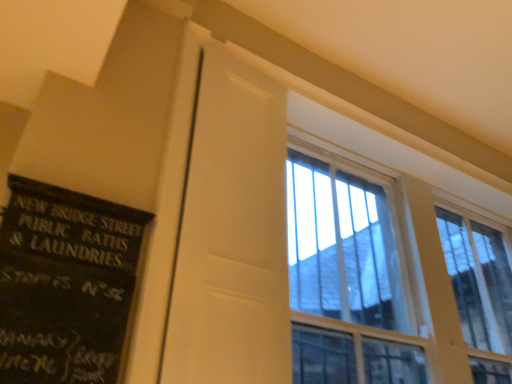
Question: Do you think black painted wood signboard at left is within white matte door at center, or outside of it?

Choices:
 (A) inside
 (B) outside

Answer: (B)

Question: Is point (108, 223) positioned closer to the camera than point (266, 271)?

Choices:
 (A) farther
 (B) closer

Answer: (B)

Question: Estimate the real-world distances between objects in this image. Which object is closer to the white matte door at center?

Choices:
 (A) black painted wood signboard at left
 (B) clear glass window at upper right

Answer: (A)

Question: Which object is the farthest from the black painted wood signboard at left?

Choices:
 (A) clear glass window at upper right
 (B) white matte door at center

Answer: (A)